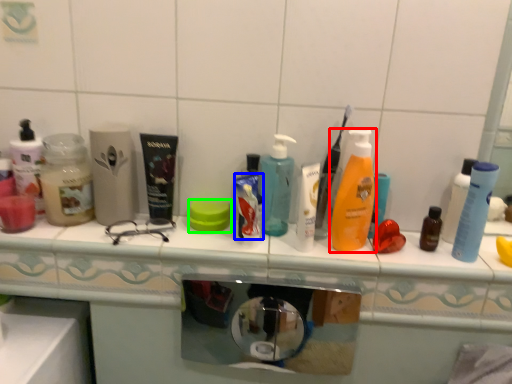
Question: Which is nearer to the bottle (highlighted by a red box)? toothpaste (highlighted by a blue box) or soap (highlighted by a green box).

Choices:
 (A) toothpaste
 (B) soap

Answer: (A)